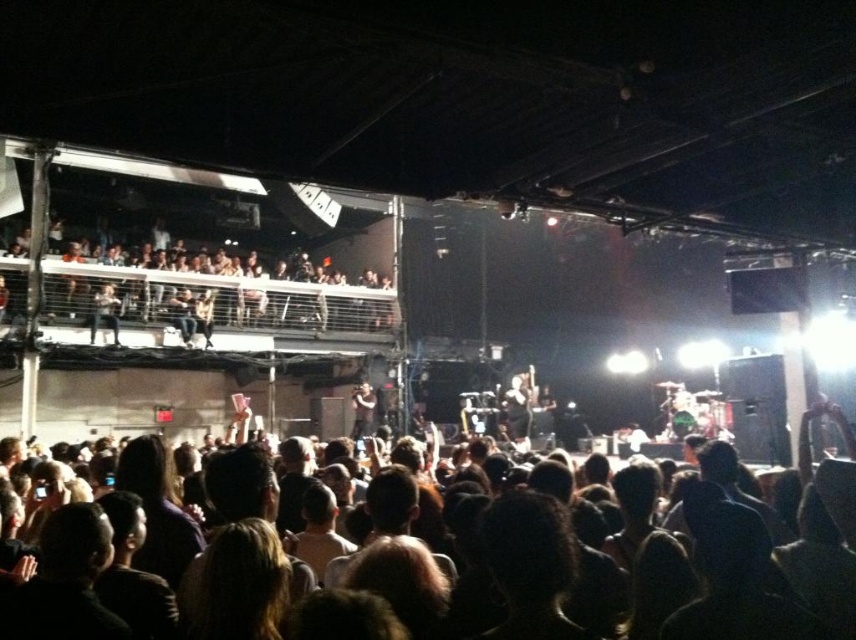
You are standing at point [538,573] and want to reach the stage. The venue has a 6.09 feet distance between you and the stage. Is there enough space to move towards the stage without obstacles?

The distance between you and the stage is 6.09 feet, so there is enough space to move towards the stage without obstacles as the distance is sufficient for movement.

You are a photographer at the concert. You want to capture a photo of the dark hair at center and the matte black jacket at upper left. Which object should you focus on first if you want to ensure both are in focus without changing the camera settings?

The dark hair at center is shorter than the matte black jacket at upper left, so you should focus on the matte black jacket at upper left first because it is farther away. This way, the depth of field will cover both objects more effectively.

You are at a concert and want to take a photo of the stage. You notice two people in front of you. One has dark hair at center and another is wearing a matte black jacket at upper left. Which person is blocking your view more to the right side?

The dark hair at center is blocking your view more to the right side because it is positioned to the right of the matte black jacket at upper left.